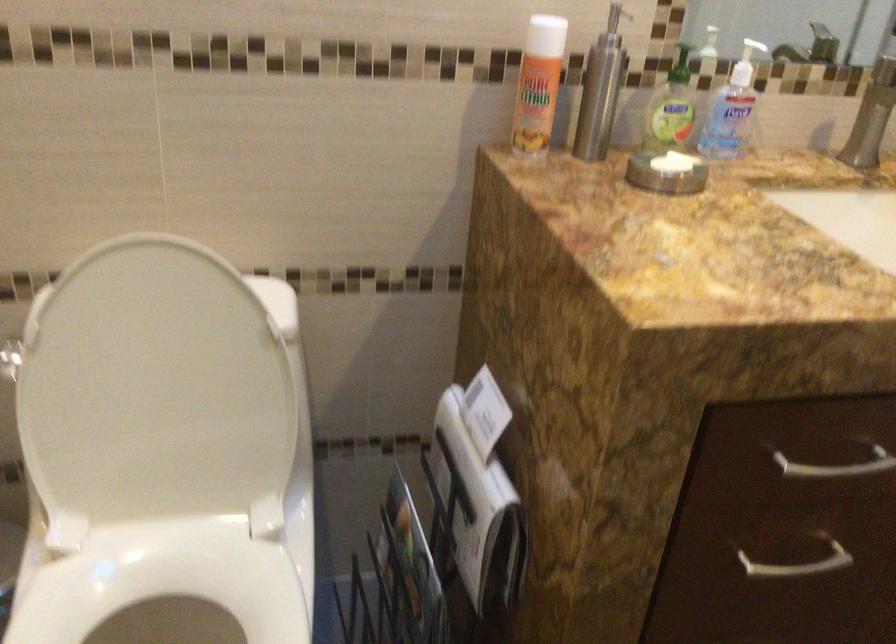
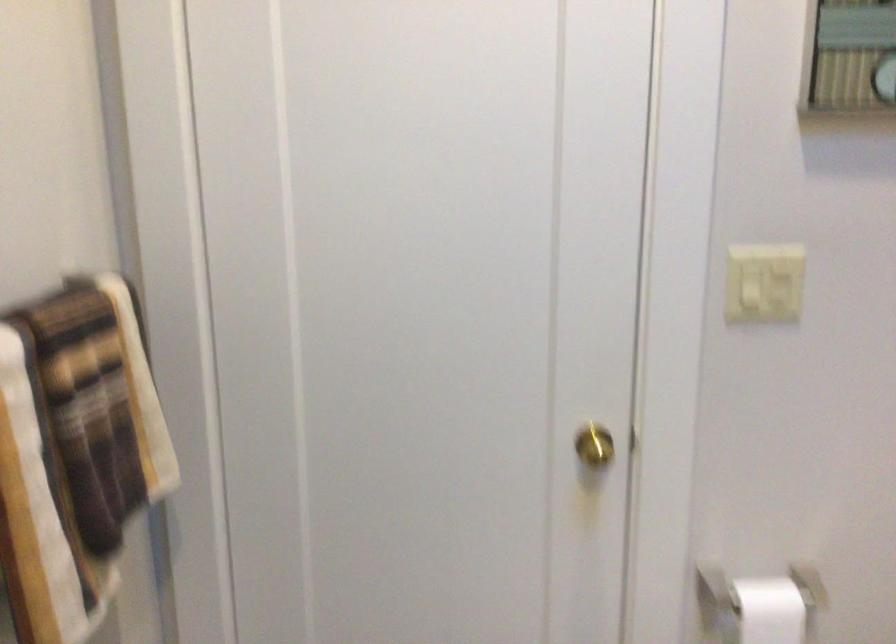
The images are taken continuously from a first-person perspective. In which direction is your viewpoint rotating?

The rotation direction of the camera is left-down.